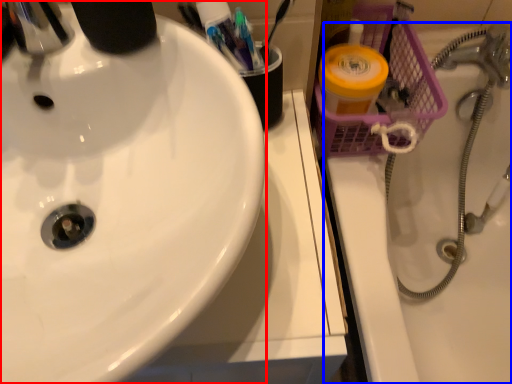
Question: Which object is further to the camera taking this photo, sink (highlighted by a red box) or bath (highlighted by a blue box)?

Choices:
 (A) sink
 (B) bath

Answer: (B)